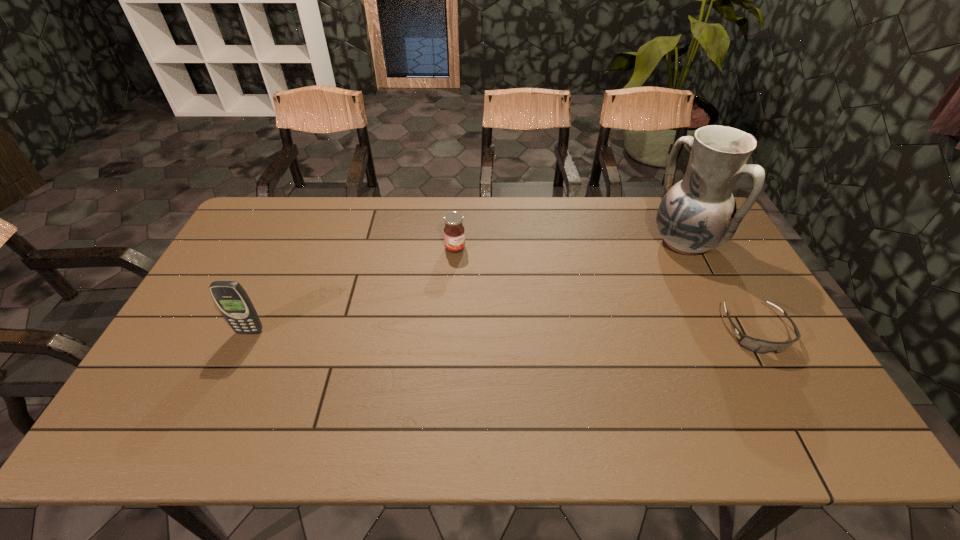
Identify the location of vacant position at the left edge of the desktop. (222, 316).

The height and width of the screenshot is (540, 960). I want to click on vacant space at the right edge of the desktop, so click(x=716, y=320).

The width and height of the screenshot is (960, 540). Identify the location of free spot at the far left corner of the desktop. (287, 214).

Find the location of a particular element. free space at the near left corner is located at coordinates (158, 389).

Identify the location of free spot between the tallest object and the shortest object. (720, 287).

Identify the location of vacant space in between the second shortest object and the shortest object. This screenshot has width=960, height=540. (605, 289).

Where is `empty space between the second object from left to right and the pitcher`? This screenshot has height=540, width=960. empty space between the second object from left to right and the pitcher is located at coordinates (569, 245).

Where is `empty space between the second tallest object and the shortest object`? This screenshot has height=540, width=960. empty space between the second tallest object and the shortest object is located at coordinates [503, 331].

This screenshot has width=960, height=540. What are the coordinates of `empty space between the goggles and the cellular telephone` in the screenshot? It's located at (503, 331).

The width and height of the screenshot is (960, 540). In order to click on vacant space that is in between the shortest object and the second tallest object in this screenshot , I will do `click(503, 331)`.